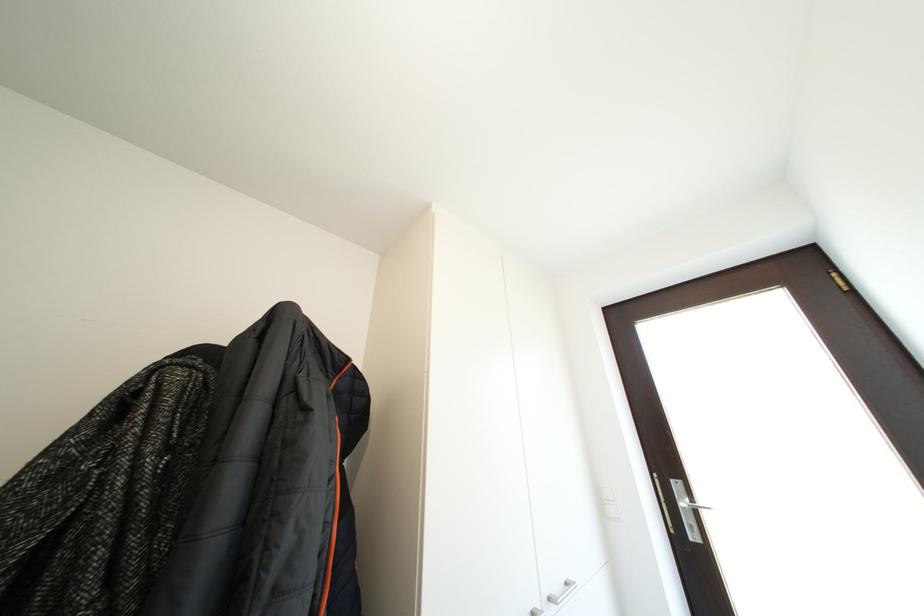
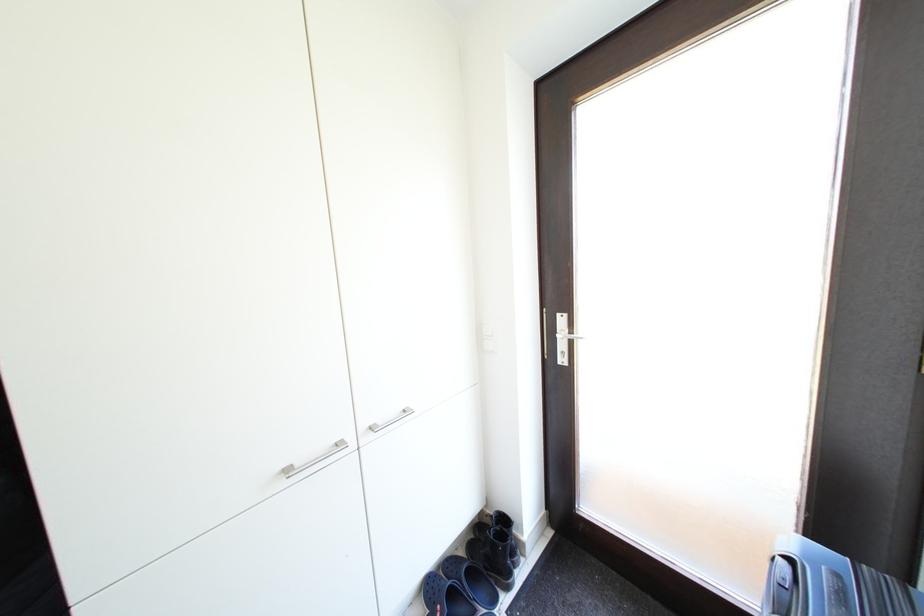
Question: How did the camera likely rotate?

Choices:
 (A) Left
 (B) Right
 (C) Up
 (D) Down

Answer: (D)